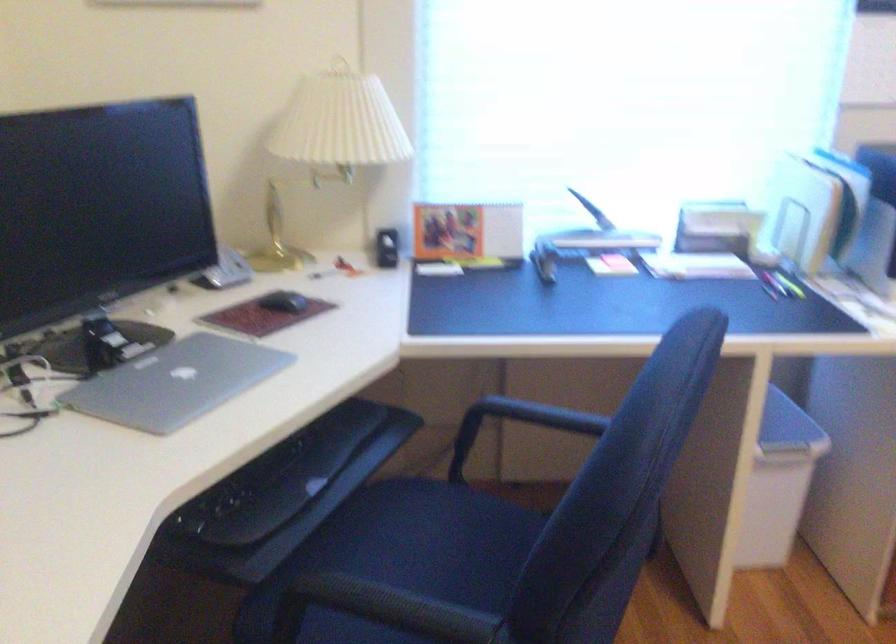
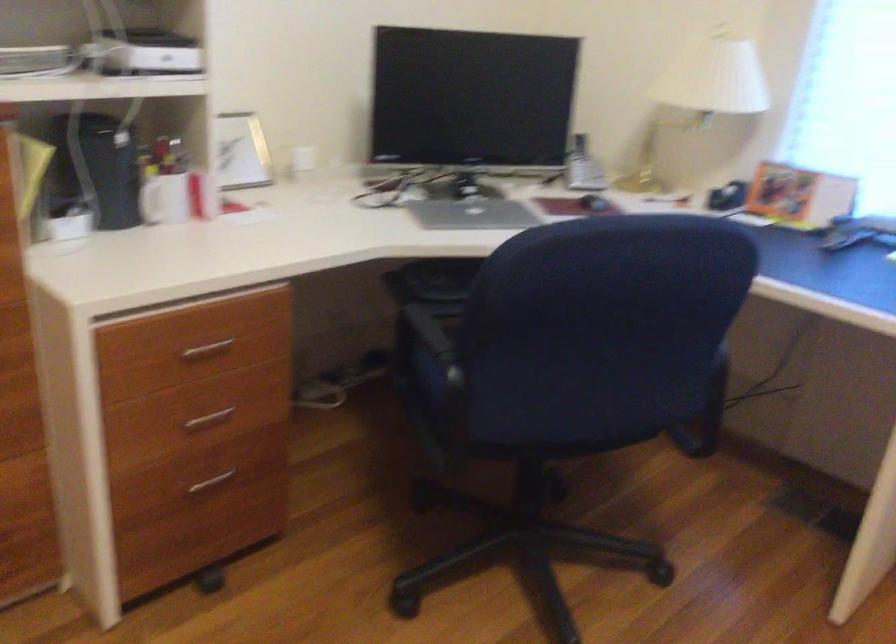
Question: The camera is either moving clockwise (left) or counter-clockwise (right) around the object. The first image is from the beginning of the video and the second image is from the end. Is the camera moving left or right when shooting the video?

Choices:
 (A) Left
 (B) Right

Answer: (B)